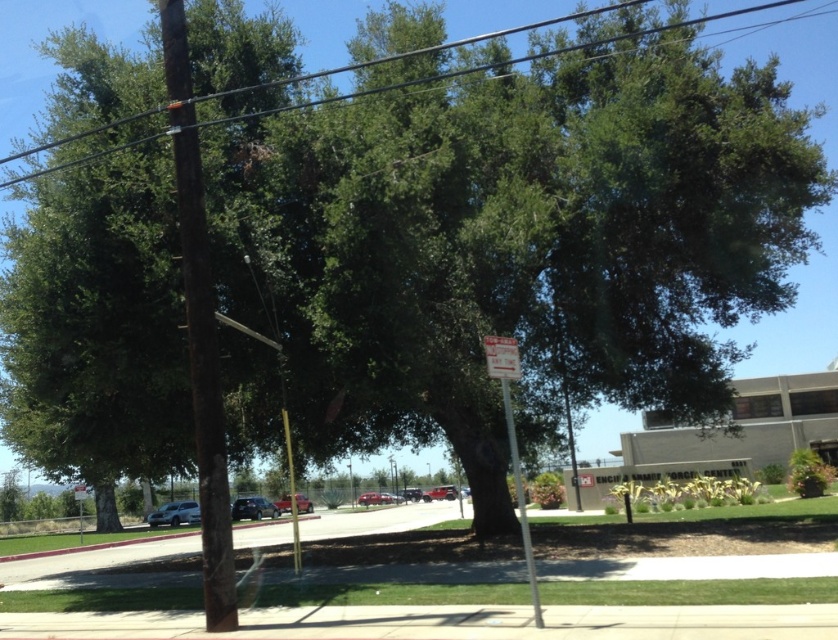
Question: Can you confirm if green leafy tree at upper center is smaller than satin silver suv at lower left?

Choices:
 (A) yes
 (B) no

Answer: (B)

Question: Based on their relative distances, which object is nearer to the green leafy tree at upper center?

Choices:
 (A) shiny black sedan at center
 (B) satin silver suv at lower left
 (C) smooth wooden pole at center

Answer: (C)

Question: Is satin silver suv at lower left wider than shiny black sedan at center?

Choices:
 (A) yes
 (B) no

Answer: (B)

Question: Does shiny black sedan at center appear on the right side of matte red truck at center?

Choices:
 (A) no
 (B) yes

Answer: (A)

Question: Which object appears farthest from the camera in this image?

Choices:
 (A) metallic reflective sign at center
 (B) shiny black sedan at center
 (C) green leafy tree at upper center
 (D) satin silver suv at lower left

Answer: (D)

Question: Which point is closer to the camera?

Choices:
 (A) satin silver suv at lower left
 (B) green leafy tree at upper center

Answer: (B)